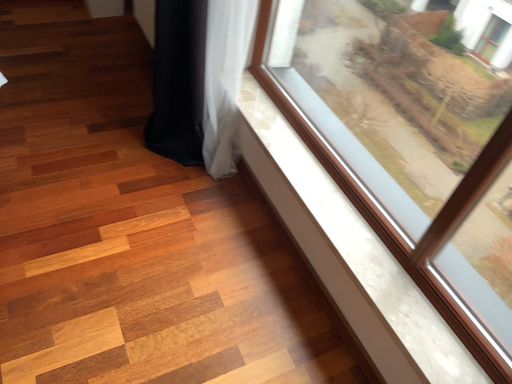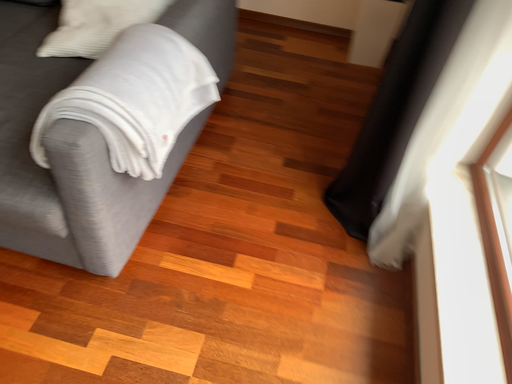
Question: Which way did the camera rotate in the video?

Choices:
 (A) rotated left
 (B) rotated right

Answer: (A)